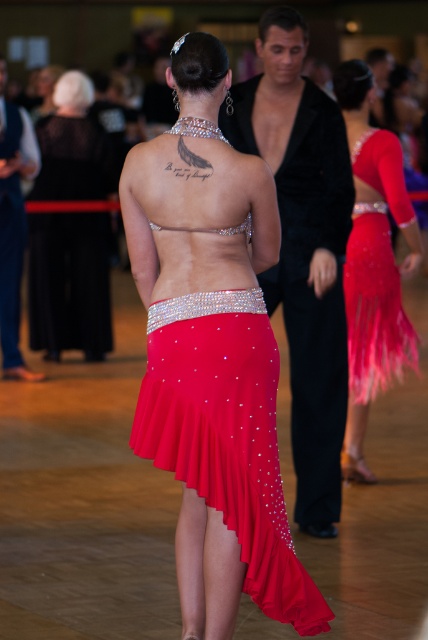
You are a photographer at the dance event and need to capture a closeup shot of both the shiny satin skirt at center and the shiny sequined skirt at center. The camera you are using has a maximum focus range of 8 feet. Can you capture both skirts in focus without moving the camera?

The shiny satin skirt at center is 8.94 feet from the shiny sequined skirt at center, which exceeds the camera maximum focus range of 8 feet. Therefore, you cannot capture both skirts in focus without moving the camera.

You are standing in the dance competition venue and want to determine which of the two points, point (372,369) or point (73,252), is nearer to you. Based on the scene provided, which point is closer?

Point (372,369) is closer to the viewer than point (73,252).

Based on the coordinates provided in the scene, where exactly is the shiny satin skirt at center located?

The shiny satin skirt at center is located at point coordinates of 0.681 on the x axis and 0.530 on the y axis.